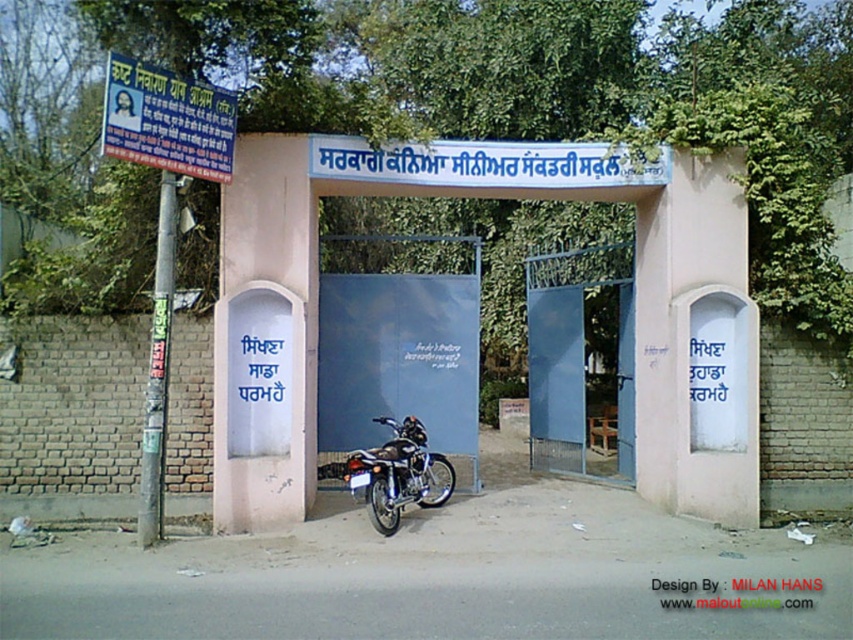
Can you confirm if blue plastic signboard at left is positioned to the left of shiny metallic motorcycle at center?

Indeed, blue plastic signboard at left is positioned on the left side of shiny metallic motorcycle at center.

Can you confirm if blue plastic signboard at left is wider than shiny metallic motorcycle at center?

Correct, the width of blue plastic signboard at left exceeds that of shiny metallic motorcycle at center.

Identify the location of blue plastic signboard at left. This screenshot has width=853, height=640. (163, 212).

Image resolution: width=853 pixels, height=640 pixels. I want to click on blue plastic signboard at left, so click(x=163, y=212).

Is blue plastic signboard at left taller than blue plastic signboard at upper left?

Correct, blue plastic signboard at left is much taller as blue plastic signboard at upper left.

Measure the distance between blue plastic signboard at left and camera.

They are 7.78 meters apart.

Between point (115, 83) and point (161, 150), which one is positioned behind?

Positioned behind is point (161, 150).

The height and width of the screenshot is (640, 853). What are the coordinates of `blue plastic signboard at left` in the screenshot? It's located at (163, 212).

In the scene shown: Which of these two, blue plastic signboard at upper left or shiny metallic motorcycle at center, stands taller?

blue plastic signboard at upper left

From the picture: Does blue plastic signboard at upper left have a greater height compared to shiny metallic motorcycle at center?

Yes.

Identify the location of blue plastic signboard at upper left. This screenshot has height=640, width=853. point(167,120).

Locate an element on the screen. This screenshot has height=640, width=853. blue plastic signboard at upper left is located at coordinates (167, 120).